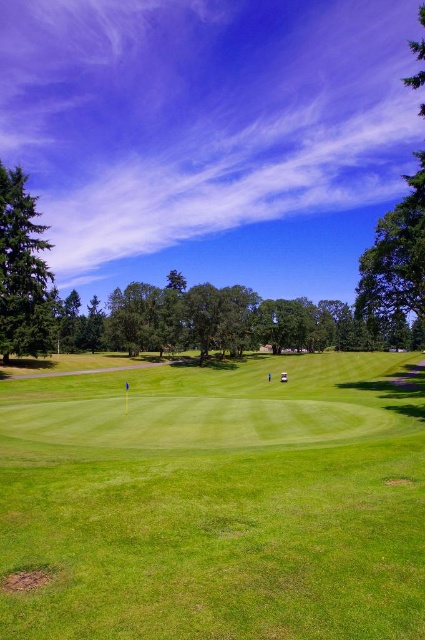
Does green grassy golf course at center have a lesser width compared to green textured pine tree at left?

No.

Does point (121, 628) come farther from viewer compared to point (28, 276)?

No.

Is point (285, 563) positioned before point (17, 266)?

Yes, it is.

Where is `green grassy golf course at center`? The width and height of the screenshot is (425, 640). green grassy golf course at center is located at coordinates (215, 502).

Can you confirm if green leafy tree at right is smaller than green textured pine tree at left?

Actually, green leafy tree at right might be larger than green textured pine tree at left.

Which is behind, point (422, 273) or point (28, 326)?

The point (28, 326) is behind.

Is point (376, 243) in front of point (10, 216)?

Yes, point (376, 243) is in front of point (10, 216).

Locate an element on the screen. This screenshot has width=425, height=640. green leafy tree at right is located at coordinates (394, 262).

Does green grassy golf course at center appear on the left side of green leafy tree at right?

Indeed, green grassy golf course at center is positioned on the left side of green leafy tree at right.

Between green grassy golf course at center and green leafy tree at right, which one is positioned lower?

green grassy golf course at center is lower down.

Between point (146, 620) and point (421, 8), which one is positioned in front?

Positioned in front is point (146, 620).

Where is `green grassy golf course at center`? green grassy golf course at center is located at coordinates (215, 502).